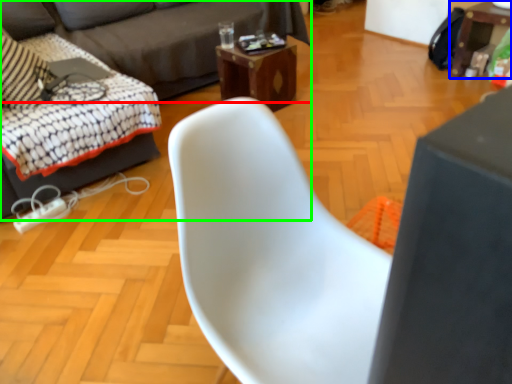
Question: Which object is the closest to the studio couch (highlighted by a red box)? Choose among these: table (highlighted by a blue box) or studio couch (highlighted by a green box).

Choices:
 (A) table
 (B) studio couch

Answer: (B)